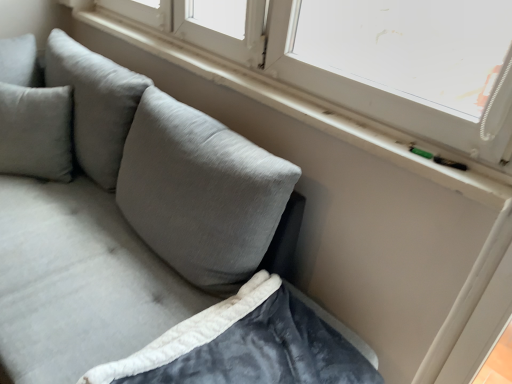
What do you see at coordinates (359, 93) in the screenshot? This screenshot has height=384, width=512. I see `white plastic window at upper right` at bounding box center [359, 93].

Where is `velvety dark gray blanket at lower left`? This screenshot has width=512, height=384. velvety dark gray blanket at lower left is located at coordinates (245, 345).

The height and width of the screenshot is (384, 512). Find the location of `white plastic window at upper right`. white plastic window at upper right is located at coordinates (359, 93).

Between white plastic window at upper right and velvet gray couch at lower left, which one has less height?

With less height is white plastic window at upper right.

How different are the orientations of white plastic window at upper right and velvet gray couch at lower left in degrees?

1.51 degrees separate the facing orientations of white plastic window at upper right and velvet gray couch at lower left.

Looking at their sizes, would you say white plastic window at upper right is wider or thinner than velvet gray couch at lower left?

Clearly, white plastic window at upper right has less width compared to velvet gray couch at lower left.

Is velvet gray couch at lower left surrounded by white plastic window at upper right?

No, velvet gray couch at lower left is not inside white plastic window at upper right.

Are velvet gray couch at lower left and white plastic window at upper right beside each other?

No.

Considering the positions of objects velvet gray couch at lower left and white plastic window at upper right in the image provided, who is more to the right, velvet gray couch at lower left or white plastic window at upper right?

Positioned to the right is white plastic window at upper right.

Considering the sizes of velvety dark gray blanket at lower left and velvet gray couch at lower left in the image, is velvety dark gray blanket at lower left wider or thinner than velvet gray couch at lower left?

Considering their sizes, velvety dark gray blanket at lower left looks slimmer than velvet gray couch at lower left.

How far apart are velvety dark gray blanket at lower left and velvet gray couch at lower left?

They are 11.20 inches apart.

Which point is more forward, (296, 380) or (339, 379)?

The point (296, 380) is closer.

Is velvety dark gray blanket at lower left oriented towards velvet gray couch at lower left?

Yes.

How many degrees apart are the facing directions of velvety dark gray blanket at lower left and white plastic window at upper right?

There is a 90.2-degree angle between the facing directions of velvety dark gray blanket at lower left and white plastic window at upper right.

Is the surface of velvety dark gray blanket at lower left in direct contact with white plastic window at upper right?

velvety dark gray blanket at lower left is not next to white plastic window at upper right, and they're not touching.

Between velvety dark gray blanket at lower left and white plastic window at upper right, which one has larger width?

Wider between the two is velvety dark gray blanket at lower left.

Based on the photo, from a real-world perspective, between velvet gray couch at lower left and velvety dark gray blanket at lower left, who is vertically lower?

In real-world perspective, velvet gray couch at lower left is lower.

Considering the sizes of velvet gray couch at lower left and velvety dark gray blanket at lower left in the image, is velvet gray couch at lower left taller or shorter than velvety dark gray blanket at lower left?

In the image, velvet gray couch at lower left appears to be taller than velvety dark gray blanket at lower left.

Do you think velvet gray couch at lower left is within velvety dark gray blanket at lower left, or outside of it?

velvet gray couch at lower left lies outside velvety dark gray blanket at lower left.

This screenshot has height=384, width=512. What are the coordinates of `studio couch above the velvety dark gray blanket at lower left (from the image's perspective)` in the screenshot? It's located at (145, 240).

Considering the relative positions of white plastic window at upper right and velvety dark gray blanket at lower left in the image provided, is white plastic window at upper right to the left or to the right of velvety dark gray blanket at lower left?

white plastic window at upper right is positioned on velvety dark gray blanket at lower left's left side.

In the scene shown: Is white plastic window at upper right inside or outside of velvety dark gray blanket at lower left?

white plastic window at upper right is outside velvety dark gray blanket at lower left.

Locate an element on the screen. The height and width of the screenshot is (384, 512). window above the velvet gray couch at lower left (from a real-world perspective) is located at coordinates (359, 93).

This screenshot has height=384, width=512. I want to click on window behind the velvet gray couch at lower left, so click(359, 93).

Estimate the real-world distances between objects in this image. Which object is closer to white plastic window at upper right, velvety dark gray blanket at lower left or velvet gray couch at lower left?

velvet gray couch at lower left is positioned closer to the anchor white plastic window at upper right.

Looking at the image, which one is located further to velvety dark gray blanket at lower left, white plastic window at upper right or velvet gray couch at lower left?

white plastic window at upper right lies further to velvety dark gray blanket at lower left than the other object.

Estimate the real-world distances between objects in this image. Which object is further from velvet gray couch at lower left, white plastic window at upper right or velvety dark gray blanket at lower left?

Based on the image, white plastic window at upper right appears to be further to velvet gray couch at lower left.

Estimate the real-world distances between objects in this image. Which object is closer to white plastic window at upper right, velvet gray couch at lower left or velvety dark gray blanket at lower left?

velvet gray couch at lower left.

Based on their spatial positions, is velvety dark gray blanket at lower left or white plastic window at upper right closer to velvet gray couch at lower left?

The object closer to velvet gray couch at lower left is velvety dark gray blanket at lower left.

From the image, which object appears to be nearer to velvety dark gray blanket at lower left, velvet gray couch at lower left or white plastic window at upper right?

velvet gray couch at lower left is positioned closer to the anchor velvety dark gray blanket at lower left.

Where is `studio couch between white plastic window at upper right and velvety dark gray blanket at lower left vertically`? studio couch between white plastic window at upper right and velvety dark gray blanket at lower left vertically is located at coordinates (145, 240).